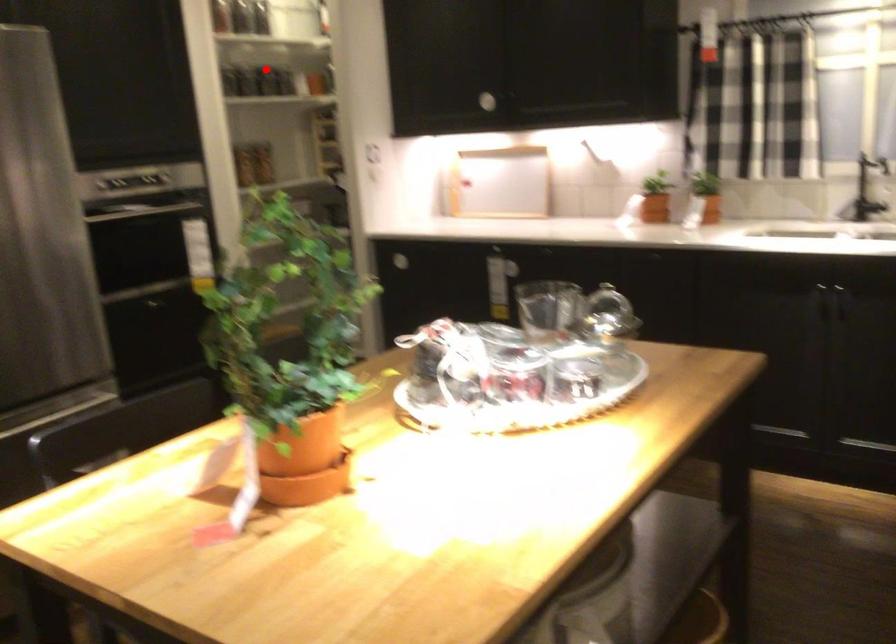
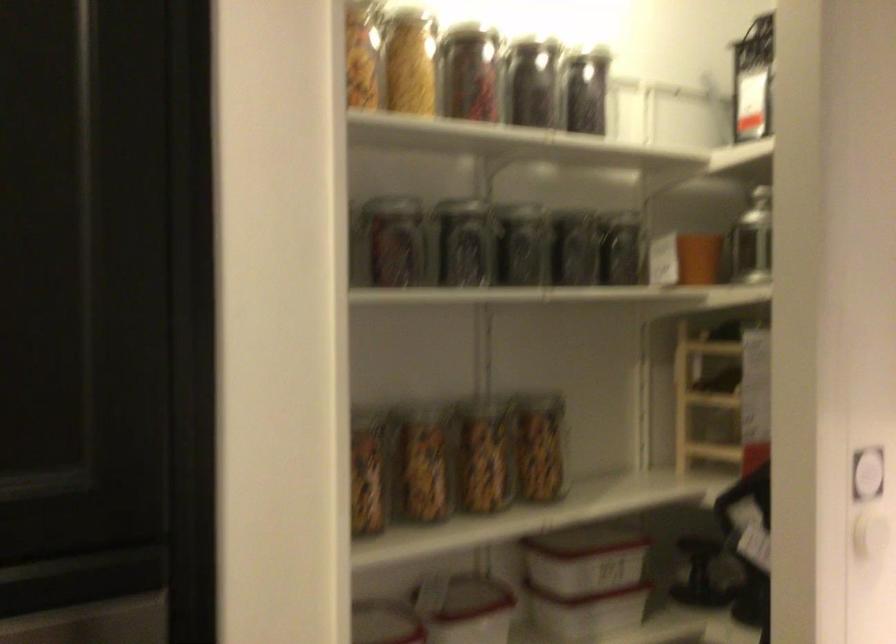
The point at the highlighted location is marked in the first image. Where is the corresponding point in the second image?

(574, 249)